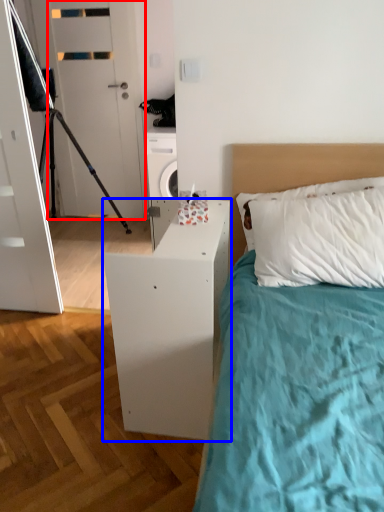
Question: Which of the following is the farthest to the observer, door (highlighted by a red box) or nightstand (highlighted by a blue box)?

Choices:
 (A) door
 (B) nightstand

Answer: (A)